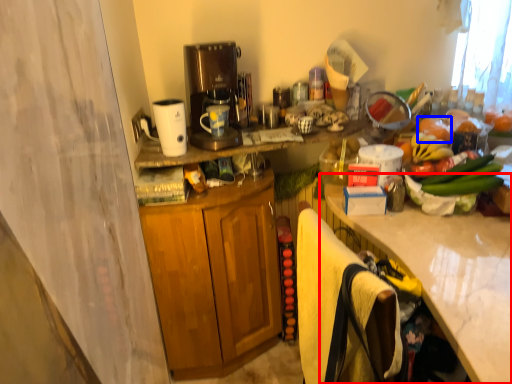
Question: Which point is closer to the camera, countertop (highlighted by a red box) or fruit (highlighted by a blue box)?

Choices:
 (A) countertop
 (B) fruit

Answer: (A)